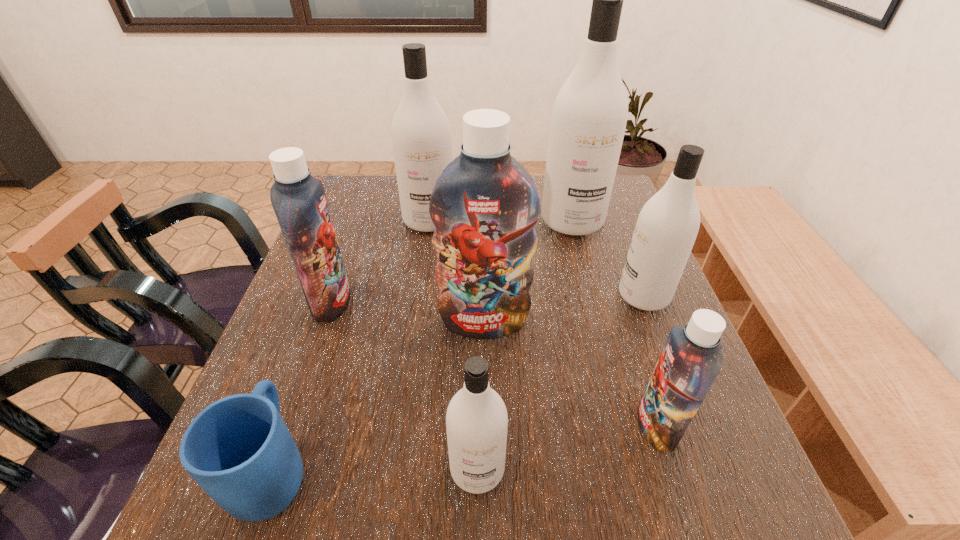
What are the coordinates of `the tallest shampoo` in the screenshot? It's located at click(x=589, y=116).

This screenshot has height=540, width=960. Identify the location of the biggest white shampoo. (589, 116).

The width and height of the screenshot is (960, 540). What are the coordinates of `the leftmost white shampoo` in the screenshot? It's located at (421, 135).

At what (x,y) coordinates should I click in order to perform the action: click on the second blue shampoo from right to left. Please return your answer as a coordinate pair (x, y). Looking at the image, I should click on (485, 204).

You are a GUI agent. You are given a task and a screenshot of the screen. Output one action in this format:
    pyautogui.click(x=<x>, y=<y>)
    Task: Click on the leftmost shampoo
    This screenshot has height=540, width=960.
    Given the screenshot: What is the action you would take?
    pyautogui.click(x=299, y=201)

Find the location of a particular element. The image size is (960, 540). the leftmost blue shampoo is located at coordinates (299, 201).

Locate an element on the screen. Image resolution: width=960 pixels, height=540 pixels. the second smallest white shampoo is located at coordinates (667, 226).

This screenshot has width=960, height=540. In order to click on the rightmost blue shampoo in this screenshot , I will do `click(690, 361)`.

Where is `the nearest blue shampoo`? Image resolution: width=960 pixels, height=540 pixels. the nearest blue shampoo is located at coordinates (690, 361).

At what (x,y) coordinates should I click in order to perform the action: click on the third white shampoo from right to left. Please return your answer as a coordinate pair (x, y). Image resolution: width=960 pixels, height=540 pixels. Looking at the image, I should click on (476, 420).